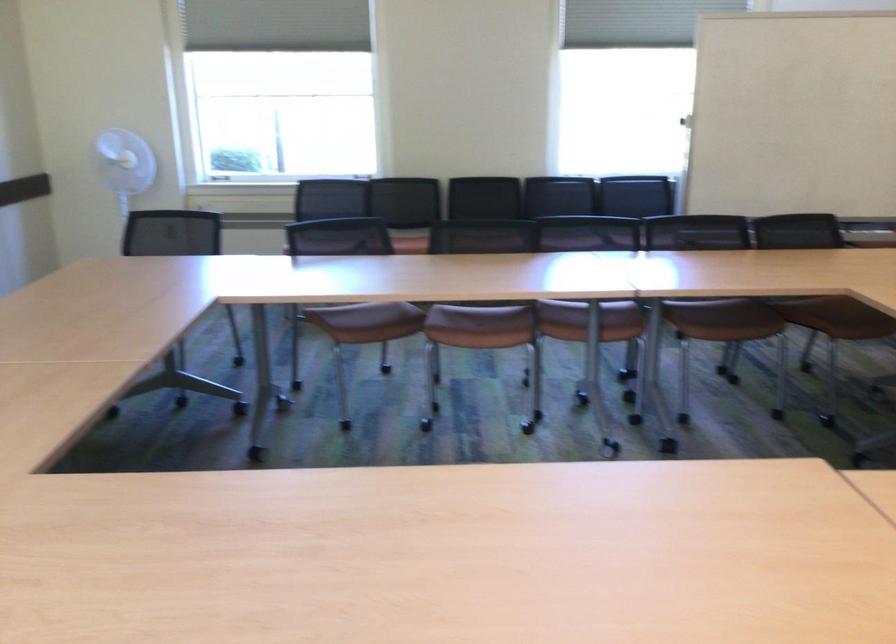
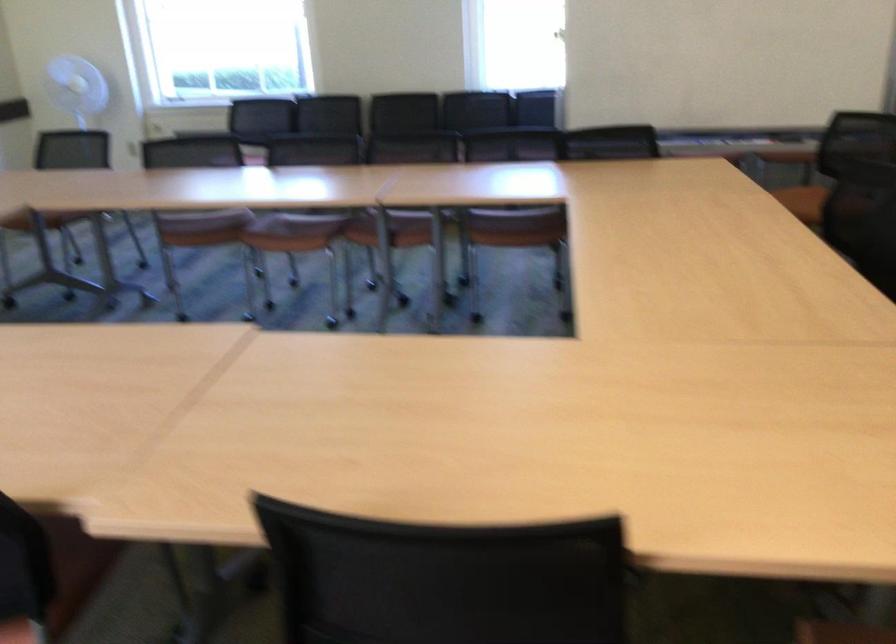
Question: I am providing you with two images of the same scene from different viewpoints. After the viewpoint changes to image2, which objects are now occluded?

Choices:
 (A) brown chair sitting surface
 (B) black chair sitting surface
 (C) black chair armrest
 (D) red ladder latch

Answer: (C)